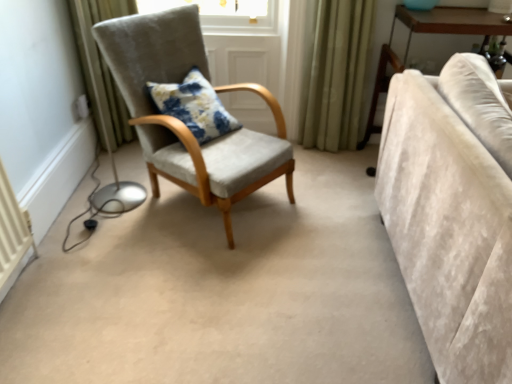
Question: Looking at their shapes, would you say floral fabric cushion at center is wider or thinner than light brown wooden table at right?

Choices:
 (A) thin
 (B) wide

Answer: (A)

Question: From a real-world perspective, is floral fabric cushion at center positioned above or below light brown wooden table at right?

Choices:
 (A) below
 (B) above

Answer: (B)

Question: Which object is the farthest from the light brown wooden table at right?

Choices:
 (A) floral fabric cushion at center
 (B) beige velvet couch at right
 (C) suede/grey chair at center

Answer: (A)

Question: Estimate the real-world distances between objects in this image. Which object is farther from the suede/grey chair at center?

Choices:
 (A) beige velvet couch at right
 (B) light brown wooden table at right
 (C) floral fabric cushion at center

Answer: (B)